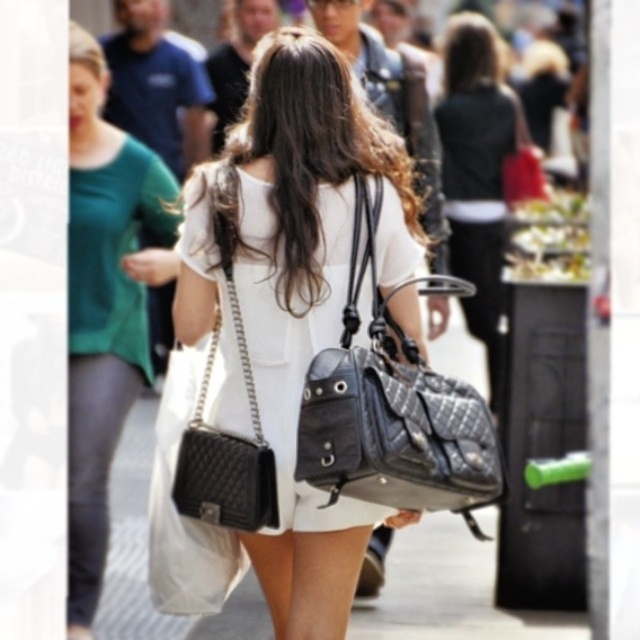
You are a photographer standing at a distance. You want to capture a clear closeup shot of the white quilted leather handbag at center. Based on the scene description, is the handbag within the minimum focusing distance of your camera lens which requires a subject to be at least 25 feet away?

The white quilted leather handbag at center is 28.47 feet away from the camera, which is beyond the minimum focusing distance requirement of 25 feet. Therefore, the camera can focus on the handbag to take a clear closeup shot.

You are a photographer trying to capture the black quilted leather handbag at center in your shot. Based on its position in the image, what are the coordinates where you should aim your camera?

The black quilted leather handbag at center is located at coordinates approximately 0.461 on the x axis and 0.458 on the y axis.